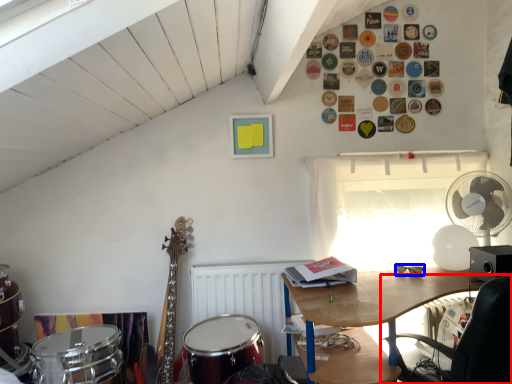
Question: Among these objects, which one is farthest to the camera, chair (highlighted by a red box) or glasses (highlighted by a blue box)?

Choices:
 (A) chair
 (B) glasses

Answer: (B)